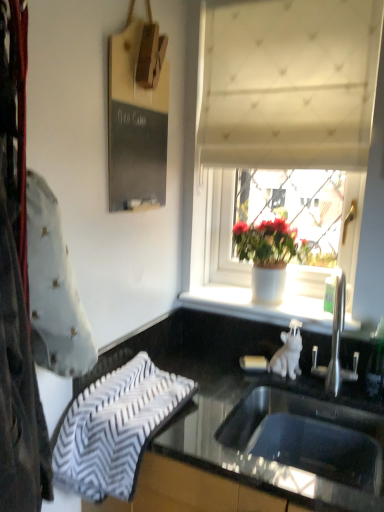
Question: From a real-world perspective, is stainless steel sink at lower center above or below white textured curtain at upper center?

Choices:
 (A) below
 (B) above

Answer: (A)

Question: From the image's perspective, is stainless steel sink at lower center positioned above or below white textured curtain at upper center?

Choices:
 (A) above
 (B) below

Answer: (B)

Question: Which object is positioned closest to the stainless steel sink at lower center?

Choices:
 (A) black chalkboard at upper left
 (B) white matte pot at center
 (C) white textured curtain at upper center
 (D) black glossy countertop at lower center
 (E) white zigzag-patterned towel at lower left

Answer: (D)

Question: Which object is positioned closest to the stainless steel sink at lower center?

Choices:
 (A) black chalkboard at upper left
 (B) black glossy countertop at lower center
 (C) white matte pot at center
 (D) white zigzag-patterned towel at lower left
 (E) white textured curtain at upper center

Answer: (B)